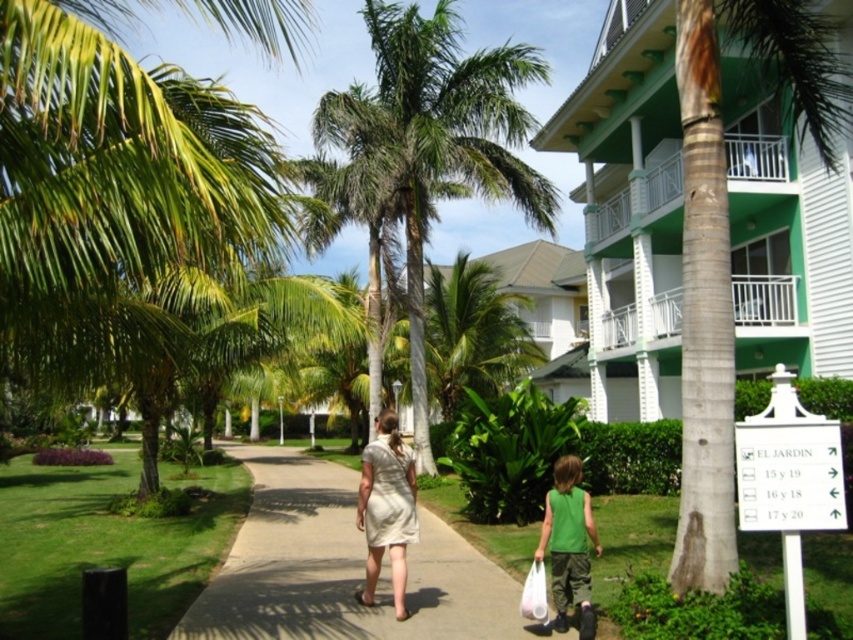
You are standing at the entrance of the resort and want to take a photo of the green painted wood balcony at upper right. The camera you are using has a maximum focus range of 20 feet. Will the balcony be in focus?

The green painted wood balcony at upper right is 20.14 feet away from the camera, which exceeds the maximum focus range of 20 feet. Therefore, the balcony will not be in focus.

You are a maintenance worker checking the structural integrity of the green painted wood balcony at upper right and the green grass at center. Which object has a smaller width?

The green painted wood balcony at upper right is thinner than the green grass at center, so the green painted wood balcony at upper right has a smaller width.

You are a landscape architect designing a new pathway. You need to place a bench between the green leafy palm tree at center and the green grass at center. Which side of the bench should face the wider object?

The green leafy palm tree at center has a larger width than the green grass at center. Therefore, the bench should face the green leafy palm tree at center since it is wider.